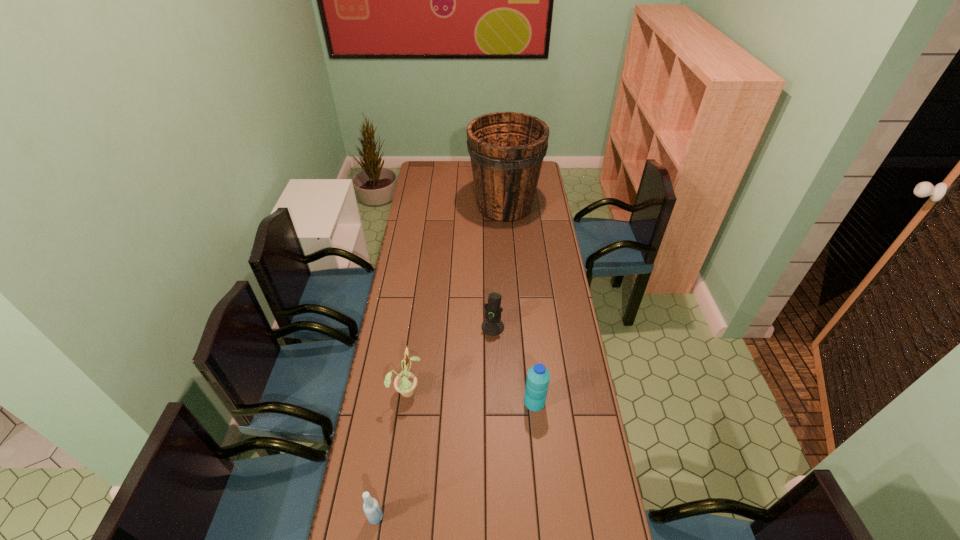
Where is `the farthest object`? The height and width of the screenshot is (540, 960). the farthest object is located at coordinates (x=507, y=149).

Where is `the tallest object`? the tallest object is located at coordinates click(507, 149).

At what (x,y) coordinates should I click in order to perform the action: click on sunflower. Please return your answer as a coordinate pair (x, y). Image resolution: width=960 pixels, height=540 pixels. Looking at the image, I should click on (405, 383).

Identify the location of water bottle. (538, 377).

You are a GUI agent. You are given a task and a screenshot of the screen. Output one action in this format:
    pyautogui.click(x=<x>, y=<y>)
    Task: Click on the microphone
    The height and width of the screenshot is (540, 960).
    Given the screenshot: What is the action you would take?
    pyautogui.click(x=492, y=326)

Image resolution: width=960 pixels, height=540 pixels. I want to click on bottle, so click(371, 507).

Locate an element on the screen. This screenshot has width=960, height=540. free space located 0.220m on the left of the farthest object is located at coordinates (428, 206).

Where is `free space located 0.310m on the front-facing side of the sunflower`? This screenshot has width=960, height=540. free space located 0.310m on the front-facing side of the sunflower is located at coordinates (508, 390).

Locate an element on the screen. blank space located 0.150m on the right of the water bottle is located at coordinates (588, 402).

The height and width of the screenshot is (540, 960). I want to click on free region located on the right of the microphone, so click(553, 327).